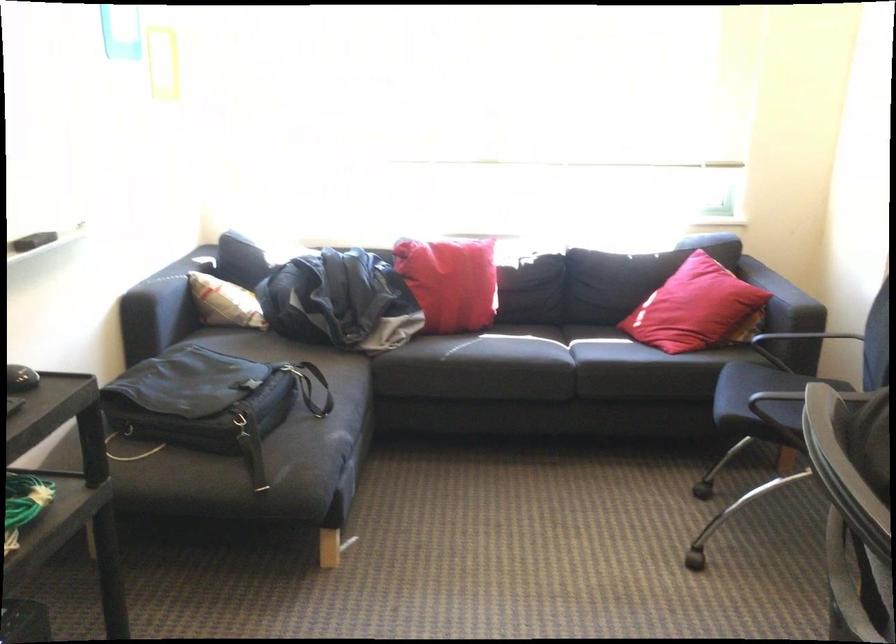
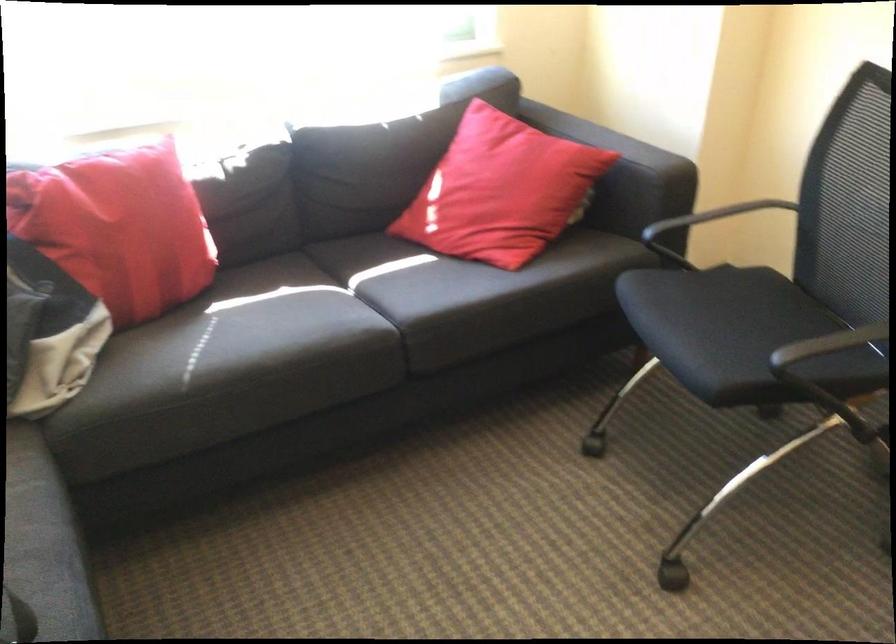
Locate, in the second image, the point that corresponds to (x=444, y=272) in the first image.

(117, 228)